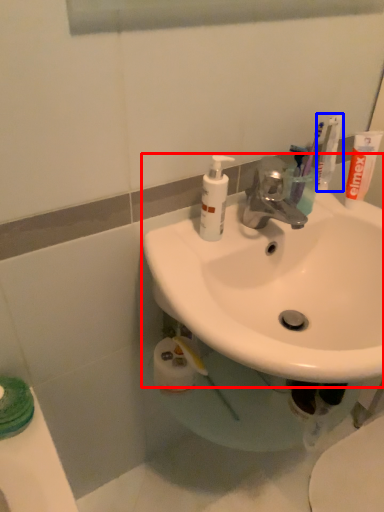
Question: Which of the following is the closest to the observer, sink (highlighted by a red box) or toothbrush (highlighted by a blue box)?

Choices:
 (A) sink
 (B) toothbrush

Answer: (A)